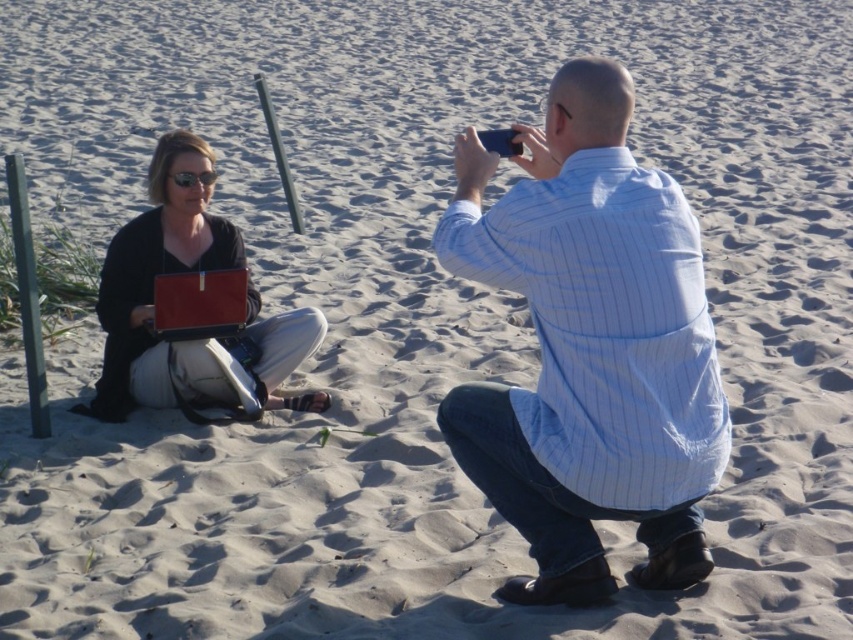
Question: Can you confirm if white striped shirt at center is positioned to the left of matte black laptop at left?

Choices:
 (A) no
 (B) yes

Answer: (A)

Question: Among these points, which one is nearest to the camera?

Choices:
 (A) (698, 406)
 (B) (238, 356)

Answer: (A)

Question: Which point is closer to the camera taking this photo?

Choices:
 (A) (201, 150)
 (B) (726, 420)

Answer: (B)

Question: Is white striped shirt at center to the right of matte black laptop at left from the viewer's perspective?

Choices:
 (A) yes
 (B) no

Answer: (A)

Question: Which of the following is the farthest from the observer?

Choices:
 (A) matte black laptop at left
 (B) white striped shirt at center

Answer: (A)

Question: Is white striped shirt at center bigger than matte black laptop at left?

Choices:
 (A) no
 (B) yes

Answer: (B)